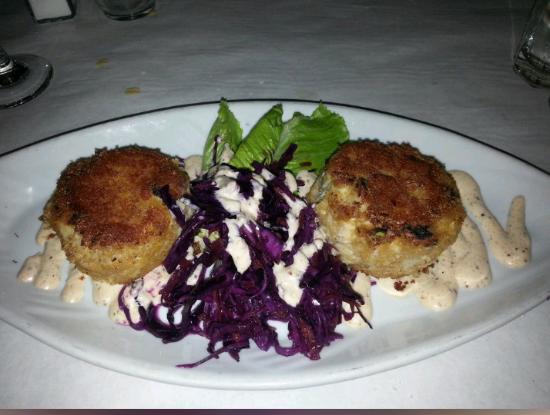
Locate an element on the screen. The width and height of the screenshot is (550, 415). table is located at coordinates (433, 75).